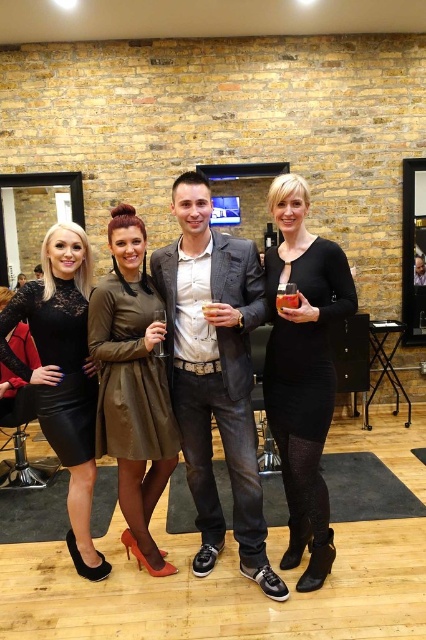
Question: Which point is farther from the camera taking this photo?

Choices:
 (A) (x=69, y=378)
 (B) (x=324, y=566)
 (C) (x=215, y=317)
 (D) (x=120, y=232)

Answer: (A)

Question: Which object is farther from the camera taking this photo?

Choices:
 (A) matte gray blazer at center
 (B) clear plastic cup at center

Answer: (A)

Question: Considering the relative positions of matte gray blazer at center and clear plastic cup at center in the image provided, where is matte gray blazer at center located with respect to clear plastic cup at center?

Choices:
 (A) above
 (B) below

Answer: (B)

Question: Can you confirm if black leather dress at center is positioned below translucent plastic cup at center?

Choices:
 (A) no
 (B) yes

Answer: (B)

Question: Is matte gray blazer at center closer to the viewer compared to black leather dress at lower left?

Choices:
 (A) no
 (B) yes

Answer: (B)

Question: Which point is farther to the camera?

Choices:
 (A) (279, 253)
 (B) (201, 260)

Answer: (A)